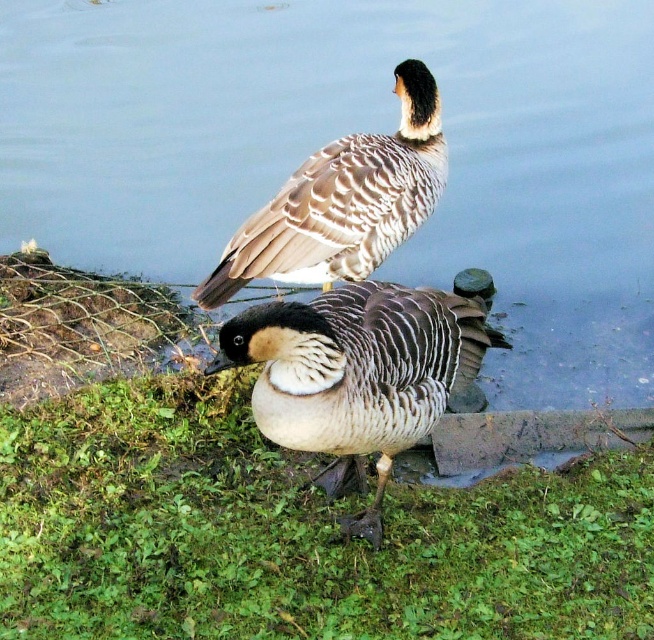
From the picture: Measure the distance from green grass at lower center to white-feathered duck at center.

green grass at lower center is 21.77 inches from white-feathered duck at center.

Can you confirm if green grass at lower center is positioned to the left of white-feathered duck at center?

Indeed, green grass at lower center is positioned on the left side of white-feathered duck at center.

Measure the distance between green grass at lower center and camera.

The distance of green grass at lower center from camera is 8.03 feet.

This screenshot has height=640, width=654. I want to click on green grass at lower center, so point(294,532).

Is white-feathered duck at center closer to camera compared to brown speckled duck at upper center?

Yes, it is in front of brown speckled duck at upper center.

Which is in front, point (266, 328) or point (328, 221)?

Point (266, 328)

In order to click on white-feathered duck at center in this screenshot , I will do 356,376.

Which is behind, point (124, 394) or point (407, 104)?

Positioned behind is point (124, 394).

Does green grass at lower center appear over brown speckled duck at upper center?

Incorrect, green grass at lower center is not positioned above brown speckled duck at upper center.

This screenshot has height=640, width=654. In order to click on green grass at lower center in this screenshot , I will do (x=294, y=532).